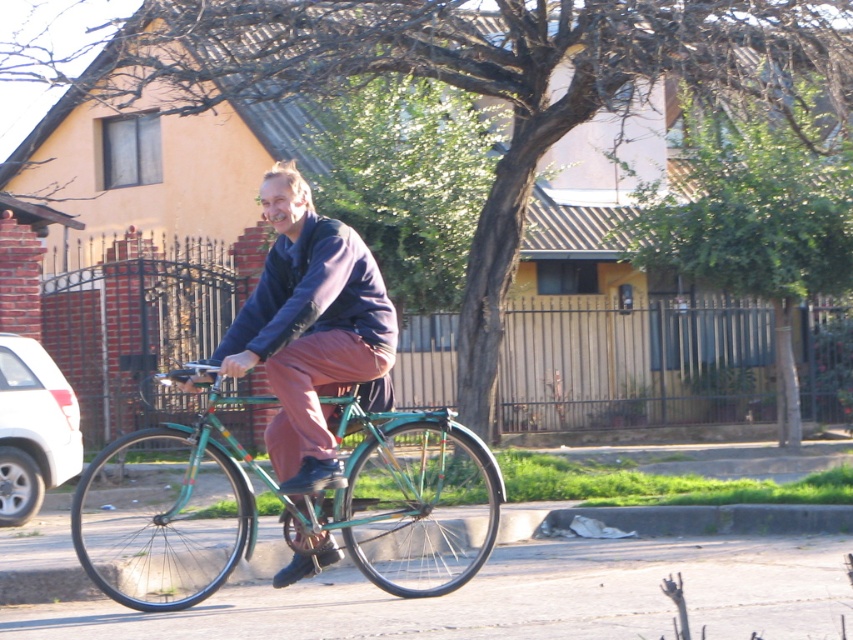
Question: Which of the following is the closest to the observer?

Choices:
 (A) dark blue fleece jacket at center
 (B) green metallic bicycle at center

Answer: (B)

Question: Can you confirm if green metallic bicycle at center is positioned to the left of dark blue fleece jacket at center?

Choices:
 (A) yes
 (B) no

Answer: (A)

Question: Is green metallic bicycle at center behind dark blue fleece jacket at center?

Choices:
 (A) yes
 (B) no

Answer: (B)

Question: Which point appears closest to the camera in this image?

Choices:
 (A) (308, 410)
 (B) (456, 513)

Answer: (A)

Question: Can you confirm if green metallic bicycle at center is positioned below dark blue fleece jacket at center?

Choices:
 (A) no
 (B) yes

Answer: (B)